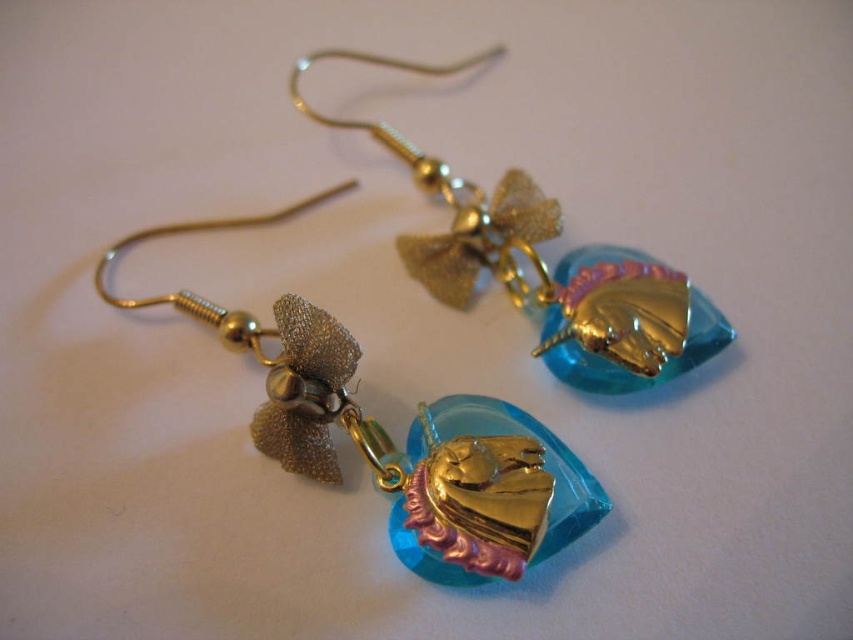
Consider the image. You are a jewelry designer who wants to create a matching necklace. You have two options for the centerpiece from the image. Which of the two options, the translucent blue glass heart at center or the translucent blue glass pendant at center, would you choose if you want the necklace to have a wider centerpiece?

The translucent blue glass heart at center has a larger width than the translucent blue glass pendant at center, so choosing the translucent blue glass heart at center would result in a wider centerpiece for the necklace.

You are a jewelry designer examining the earrings. You notice two translucent blue glass pieces at the center of each earring. Which one is positioned lower between the translucent blue glass heart at center and the translucent blue glass pendant at center?

The translucent blue glass heart at center is positioned lower than the translucent blue glass pendant at center.